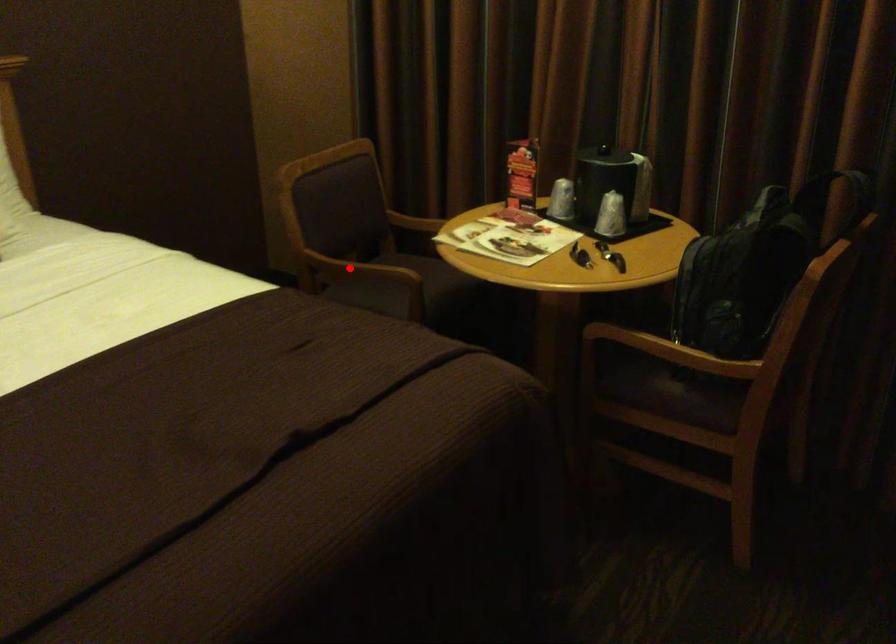
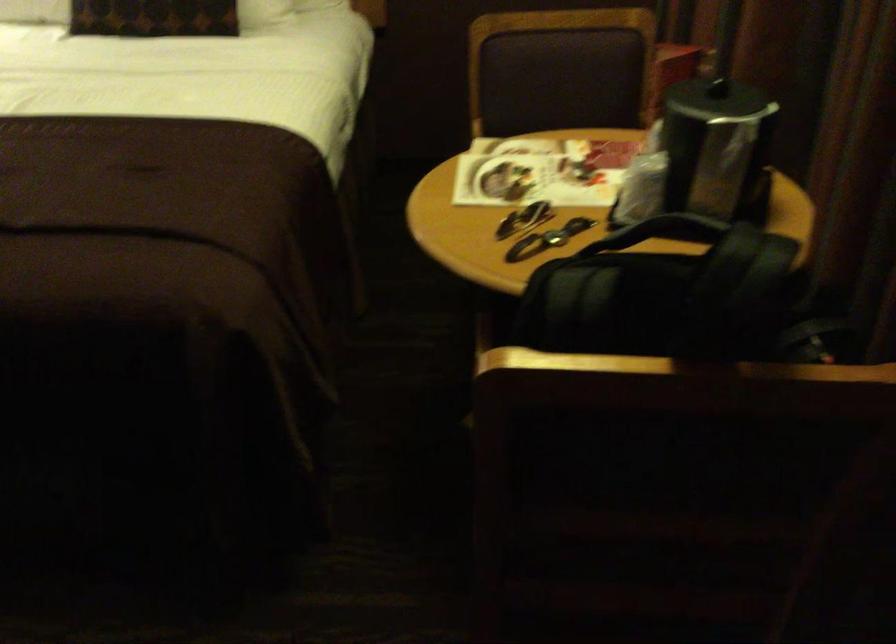
Question: I am providing you with two images of the same scene from different viewpoints. A red point is marked on the first image. Can you still see the location of the red point in image 2?

Choices:
 (A) Yes
 (B) No

Answer: (B)